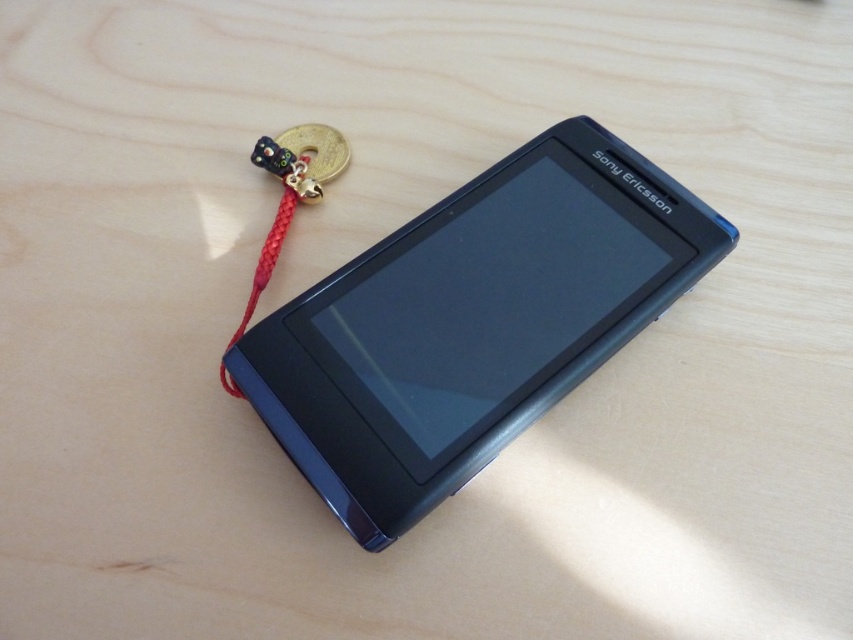
Does slate gray plastic smartphone at center have a larger size compared to red braided string at bottom left?

Yes.

Can you confirm if slate gray plastic smartphone at center is shorter than red braided string at bottom left?

No, slate gray plastic smartphone at center is not shorter than red braided string at bottom left.

Between point (328, 401) and point (282, 216), which one is positioned behind?

Point (282, 216)

Image resolution: width=853 pixels, height=640 pixels. I want to click on slate gray plastic smartphone at center, so click(x=473, y=323).